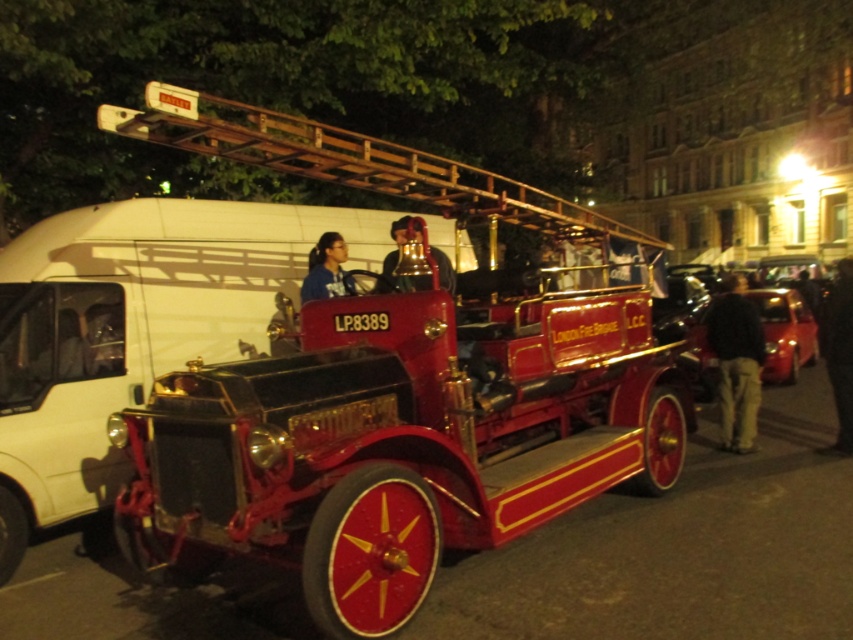
Is point (45, 280) closer to camera compared to point (697, 353)?

Yes, point (45, 280) is closer to viewer.

From the picture: Who is shorter, white matte van at center or shiny red car at right?

shiny red car at right

Find the location of a particular element. The height and width of the screenshot is (640, 853). white matte van at center is located at coordinates (132, 328).

Between shiny red fire truck at center and blue fabric jacket at center, which one appears on the right side from the viewer's perspective?

From the viewer's perspective, shiny red fire truck at center appears more on the right side.

Consider the image. Which of these two, shiny red fire truck at center or blue fabric jacket at center, stands shorter?

Standing shorter between the two is shiny red fire truck at center.

Does point (257, 552) come in front of point (334, 244)?

Yes, it is.

This screenshot has height=640, width=853. Find the location of `shiny red fire truck at center`. shiny red fire truck at center is located at coordinates (399, 390).

Does shiny red fire truck at center have a greater width compared to shiny black bell at center?

Correct, the width of shiny red fire truck at center exceeds that of shiny black bell at center.

Does point (608, 310) lie in front of point (390, 275)?

Yes, it is in front of point (390, 275).

Who is more distant from viewer, (540,401) or (402,276)?

The point (540,401) is behind.

This screenshot has height=640, width=853. I want to click on shiny red fire truck at center, so click(399, 390).